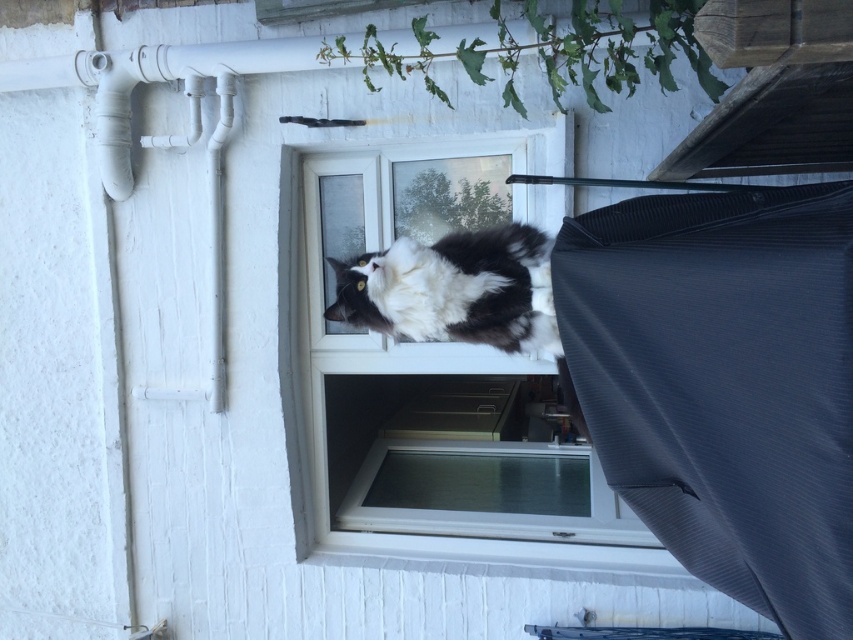
You are standing in front of a window and notice a dark grey textured fabric at right. If you want to reach it without moving your position, will you be able to do so if your arm can extend 5 feet?

The dark grey textured fabric at right is 6.22 feet away from the camera, which is beyond the 5 feet reach of your arm. Therefore, you cannot reach it without moving your position.

You are a photographer trying to capture the black and white fur cat at center and the dark grey textured fabric at right in the same frame. Which object is positioned closer to the camera?

The dark grey textured fabric at right is closer to the viewer than the black and white fur cat at center, so it will appear closer to the camera in the photo.

You are a photographer trying to capture the black and white fur cat at center through the clear glass window at center. Since the window is reflective, you need to know which part of the window will show the cat and which part will reflect the outside. Based on the scene description, which part of the window should you focus on to get a clear shot of the cat?

The clear glass window at center is taller than the black and white fur cat at center. To capture the cat clearly, focus on the lower pane of the window since the upper pane reflects the outside greenery. The lower pane shows the interior where the cat is located.